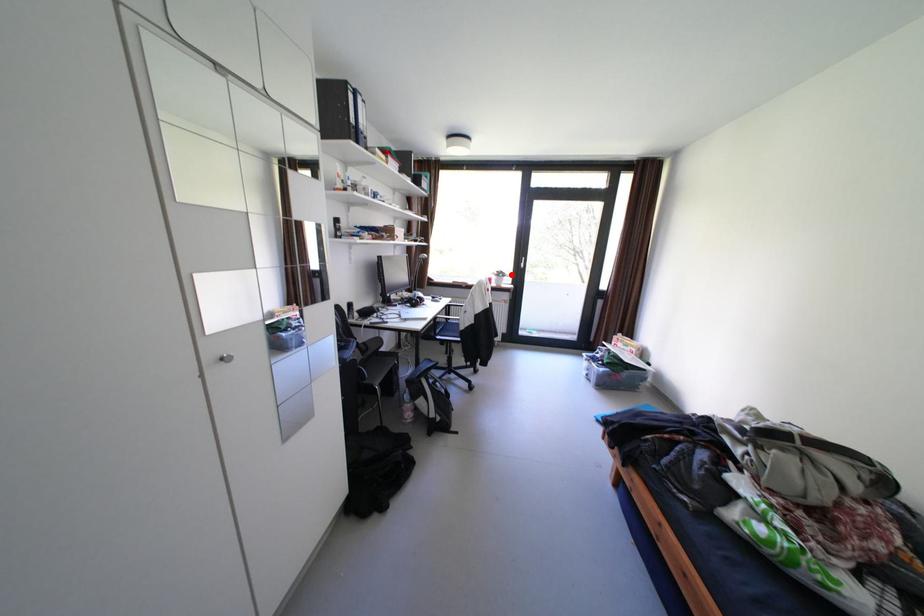
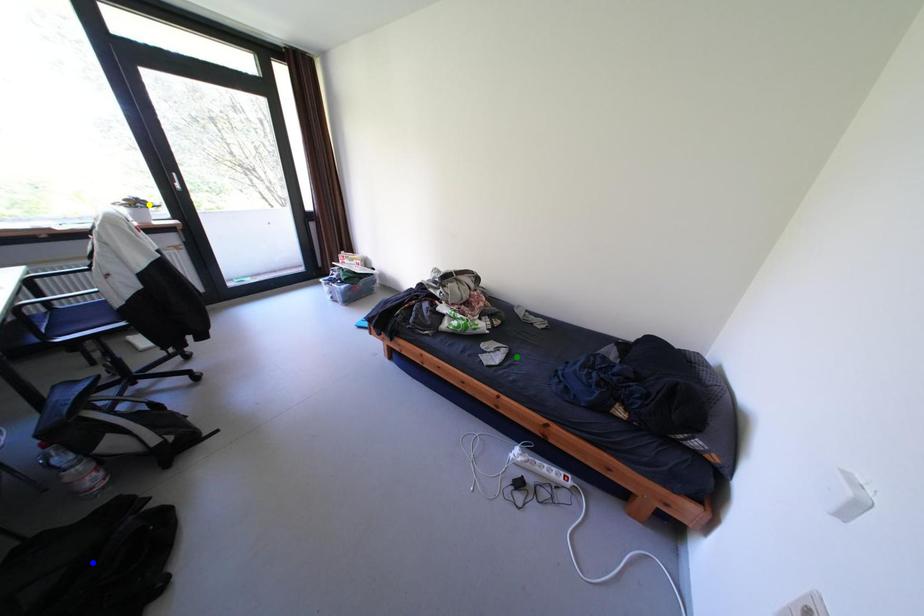
Question: I am providing you with two images of the same scene from different viewpoints. A red point is marked on the first image. You are given multiple points on the second image. In image 2, which mark is for the same physical point as the one in image 1?

Choices:
 (A) yellow point
 (B) blue point
 (C) green point

Answer: (A)